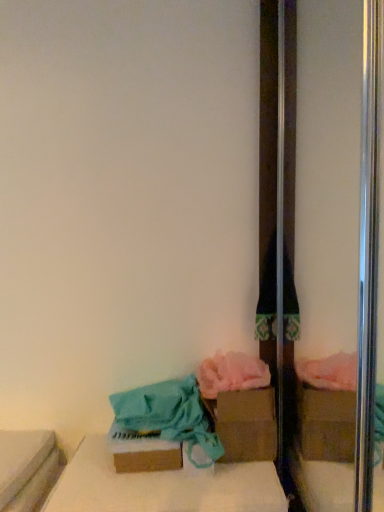
Locate an element on the screen. vacant space situated above brown cardboard box at lower center (from a real-world perspective) is located at coordinates (170, 476).